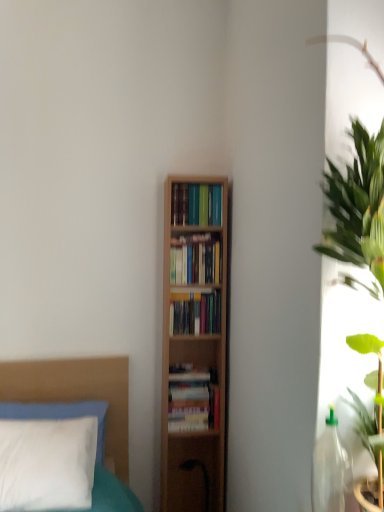
This screenshot has width=384, height=512. Find the location of `vacant region above hardcover books at center, the first book positioned from the bottom (from a real-world perspective)`. vacant region above hardcover books at center, the first book positioned from the bottom (from a real-world perspective) is located at coordinates click(x=192, y=371).